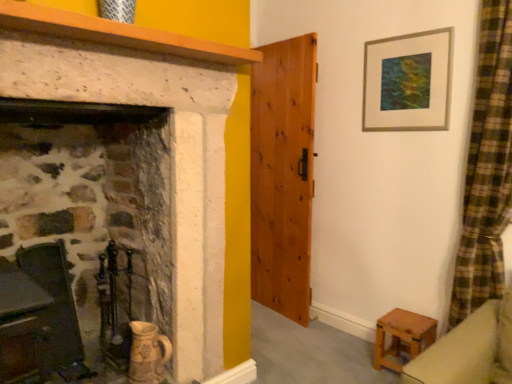
Question: Does metallic silver picture frame at upper right have a larger size compared to smooth wooden mantle at upper left?

Choices:
 (A) yes
 (B) no

Answer: (B)

Question: Does metallic silver picture frame at upper right come behind smooth wooden mantle at upper left?

Choices:
 (A) yes
 (B) no

Answer: (A)

Question: Is metallic silver picture frame at upper right beside smooth wooden mantle at upper left?

Choices:
 (A) no
 (B) yes

Answer: (A)

Question: Is metallic silver picture frame at upper right not within smooth wooden mantle at upper left?

Choices:
 (A) yes
 (B) no

Answer: (A)

Question: From a real-world perspective, is metallic silver picture frame at upper right under smooth wooden mantle at upper left?

Choices:
 (A) no
 (B) yes

Answer: (B)

Question: Considering their positions, is wooden stool at lower right located in front of or behind wooden chair at left?

Choices:
 (A) behind
 (B) front

Answer: (A)

Question: From the image's perspective, is wooden stool at lower right above or below wooden chair at left?

Choices:
 (A) above
 (B) below

Answer: (B)

Question: Is wooden stool at lower right to the left or to the right of wooden chair at left in the image?

Choices:
 (A) left
 (B) right

Answer: (B)

Question: Is wooden stool at lower right wider or thinner than wooden chair at left?

Choices:
 (A) thin
 (B) wide

Answer: (B)

Question: Considering their positions, is wooden chair at left located in front of or behind smooth wooden mantle at upper left?

Choices:
 (A) behind
 (B) front

Answer: (A)

Question: In the image, is wooden chair at left on the left side or the right side of smooth wooden mantle at upper left?

Choices:
 (A) right
 (B) left

Answer: (B)

Question: Looking at their shapes, would you say wooden chair at left is wider or thinner than smooth wooden mantle at upper left?

Choices:
 (A) thin
 (B) wide

Answer: (A)

Question: Is point (100, 291) closer or farther from the camera than point (53, 11)?

Choices:
 (A) farther
 (B) closer

Answer: (A)

Question: Is smooth wooden mantle at upper left to the left or to the right of wooden chair at left in the image?

Choices:
 (A) left
 (B) right

Answer: (B)

Question: Considering their positions, is smooth wooden mantle at upper left located in front of or behind wooden chair at left?

Choices:
 (A) behind
 (B) front

Answer: (B)